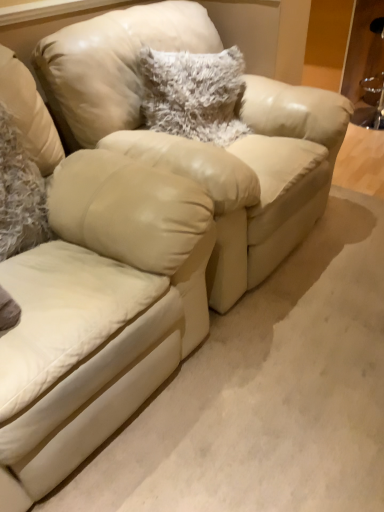
Question: Which direction should I rotate to look at fuzzy white pillow at center, which is counted as the second pillow, starting from the front?

Choices:
 (A) right
 (B) left

Answer: (A)

Question: Is matte leather swivel chair at center next to fuzzy white pillow at center, which is counted as the second pillow, starting from the front, and touching it?

Choices:
 (A) no
 (B) yes

Answer: (A)

Question: Is matte leather swivel chair at center closer to the viewer compared to fuzzy white pillow at center, which is counted as the second pillow, starting from the front?

Choices:
 (A) no
 (B) yes

Answer: (B)

Question: Does matte leather swivel chair at center come behind fuzzy white pillow at center, positioned as the first pillow in back-to-front order?

Choices:
 (A) yes
 (B) no

Answer: (B)

Question: Is matte leather swivel chair at center at the left side of fuzzy white pillow at center, acting as the second pillow starting from the left?

Choices:
 (A) no
 (B) yes

Answer: (B)

Question: Is matte leather swivel chair at center surrounding fuzzy white pillow at center, acting as the second pillow starting from the left?

Choices:
 (A) no
 (B) yes

Answer: (A)

Question: Is matte leather swivel chair at center aimed at fuzzy white pillow at center, positioned as the first pillow in back-to-front order?

Choices:
 (A) yes
 (B) no

Answer: (B)

Question: From the image's perspective, is fuzzy white pillow at center, the 1th pillow from the right, located above matte leather swivel chair at center?

Choices:
 (A) no
 (B) yes

Answer: (B)

Question: Is fuzzy white pillow at center, the 1th pillow from the right, surrounding matte leather swivel chair at center?

Choices:
 (A) yes
 (B) no

Answer: (B)

Question: Is fuzzy white pillow at center, acting as the second pillow starting from the left, oriented towards matte leather swivel chair at center?

Choices:
 (A) no
 (B) yes

Answer: (A)

Question: Considering the relative positions of fuzzy white pillow at center, which is counted as the second pillow, starting from the front, and matte leather swivel chair at center in the image provided, is fuzzy white pillow at center, which is counted as the second pillow, starting from the front, to the left of matte leather swivel chair at center from the viewer's perspective?

Choices:
 (A) no
 (B) yes

Answer: (A)

Question: Is fuzzy white pillow at center, which is counted as the second pillow, starting from the front, wider than matte leather swivel chair at center?

Choices:
 (A) no
 (B) yes

Answer: (A)

Question: Considering the relative sizes of fuzzy white pillow at center, which is counted as the second pillow, starting from the front, and matte leather swivel chair at center in the image provided, is fuzzy white pillow at center, which is counted as the second pillow, starting from the front, smaller than matte leather swivel chair at center?

Choices:
 (A) yes
 (B) no

Answer: (A)

Question: Could fuzzy white pillow at left, the second pillow from the right, be considered to be inside matte leather swivel chair at center?

Choices:
 (A) no
 (B) yes

Answer: (B)